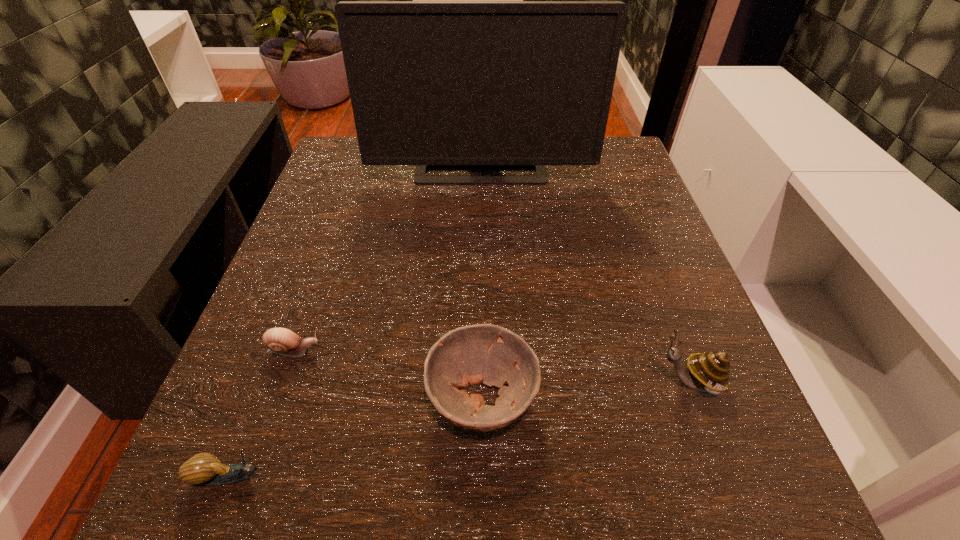
You are a GUI agent. You are given a task and a screenshot of the screen. Output one action in this format:
    pyautogui.click(x=<x>, y=<y>)
    Task: Click on the object that is at the far left corner
    The width and height of the screenshot is (960, 540).
    Given the screenshot: What is the action you would take?
    pyautogui.click(x=438, y=84)

Where is `object located in the near left corner section of the desktop`? object located in the near left corner section of the desktop is located at coordinates (204, 468).

The width and height of the screenshot is (960, 540). Identify the location of object present at the far right corner. (438, 84).

The image size is (960, 540). I want to click on free space at the far edge of the desktop, so click(524, 170).

Identify the location of free space at the near edge of the desktop. (582, 474).

The image size is (960, 540). What are the coordinates of `free spot at the left edge of the desktop` in the screenshot? It's located at (300, 296).

You are a GUI agent. You are given a task and a screenshot of the screen. Output one action in this format:
    pyautogui.click(x=<x>, y=<y>)
    Task: Click on the free space at the right edge
    This screenshot has height=540, width=960.
    Given the screenshot: What is the action you would take?
    pyautogui.click(x=636, y=316)

At what (x,y) coordinates should I click in order to perform the action: click on vacant space at the far left corner. Please return your answer as a coordinate pair (x, y). This screenshot has width=960, height=540. Looking at the image, I should click on (323, 174).

You are a GUI agent. You are given a task and a screenshot of the screen. Output one action in this format:
    pyautogui.click(x=<x>, y=<y>)
    Task: Click on the vacant position at the near left corner of the desktop
    Image resolution: width=960 pixels, height=540 pixels.
    Given the screenshot: What is the action you would take?
    pyautogui.click(x=260, y=493)

The width and height of the screenshot is (960, 540). Identify the location of free region at the far right corner. (608, 140).